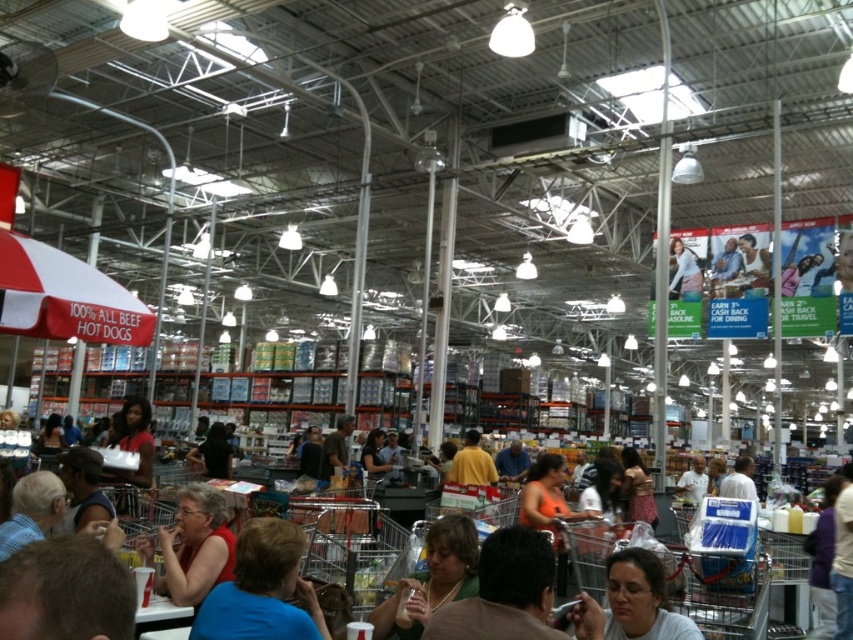
Is red fabric shirt at center positioned before orange fabric shirt at center?

Yes, red fabric shirt at center is closer to the viewer.

Who is more distant from viewer, (248, 616) or (370, 461)?

The point (370, 461) is more distant.

Identify the location of red fabric shirt at center. This screenshot has width=853, height=640. pos(262,589).

Is the position of brown leather jacket at center more distant than that of matte brown shirt at center?

No, it is in front of matte brown shirt at center.

Between brown leather jacket at center and matte brown shirt at center, which one appears on the left side from the viewer's perspective?

matte brown shirt at center

Is point (524, 531) farther from viewer compared to point (401, 588)?

No, (524, 531) is closer to viewer.

The height and width of the screenshot is (640, 853). I want to click on brown leather jacket at center, so click(x=503, y=593).

Is point (527, 564) positioned in front of point (364, 468)?

Yes, point (527, 564) is closer to viewer.

Does brown leather jacket at center appear under orange fabric shirt at center?

Actually, brown leather jacket at center is above orange fabric shirt at center.

What do you see at coordinates (503, 593) in the screenshot?
I see `brown leather jacket at center` at bounding box center [503, 593].

Find the location of a particular element. The height and width of the screenshot is (640, 853). brown leather jacket at center is located at coordinates (503, 593).